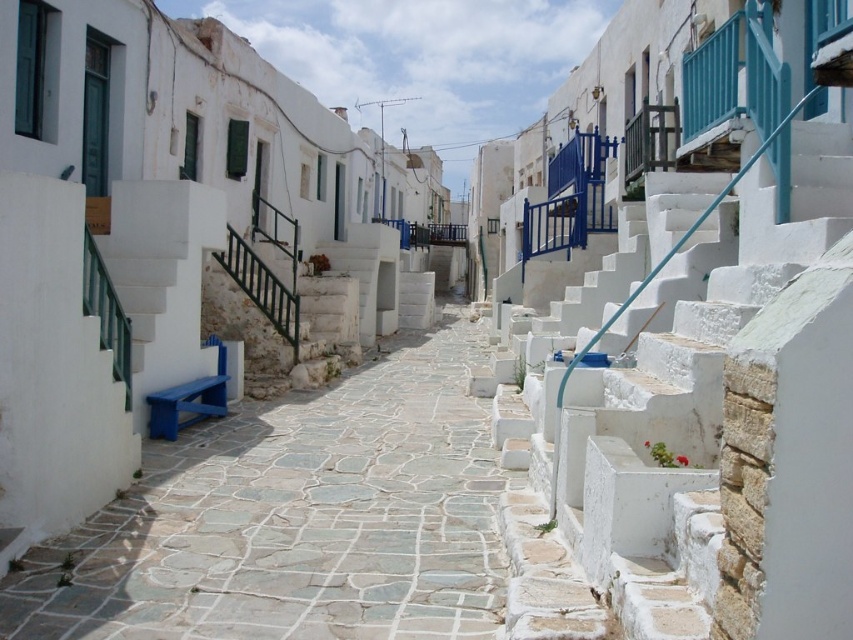
You are a delivery person with a cart that is 1.2 meters wide. You need to navigate through the narrow street. Can your cart fit through the white stone stairs at upper right and the stone paved path at center?

The white stone stairs at upper right has a width less than the stone paved path at center. Since the cart is 1.2 meters wide, it can only fit through the stone paved path at center if its width is at least 1.2 meters. The question does not provide the exact width of the path, so we cannot confirm if the cart will fit through either the stairs or the path.

You are a delivery person trying to reach the entrance of the house at the upper right. There is a point marked at coordinates [697,429]. Is this point located on the white stone stairs leading to the entrance?

Yes, the point [697,429] is on the white stone stairs at upper right, so it is located on the stairs leading to the entrance.

You are a delivery person carrying a heavy box and need to walk from the entrance of the village to the house at the top of the white stone stairs at upper right. The path you must take is the stone paved path at center. Considering the height difference between the stairs and the path, will you need to climb up or go downhill to reach the house?

The white stone stairs at upper right is taller than the stone paved path at center, so you will need to climb up to reach the house.